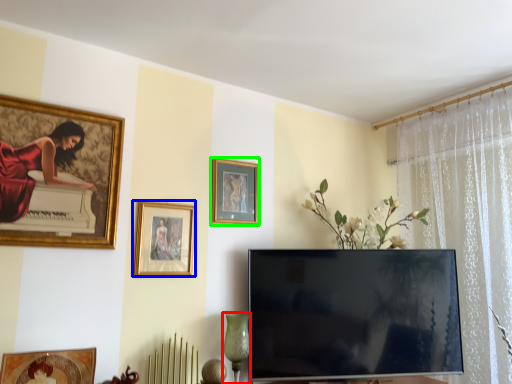
Question: Based on their relative distances, which object is nearer to glass vase (highlighted by a red box)? Choose from picture frame (highlighted by a blue box) and picture frame (highlighted by a green box).

Choices:
 (A) picture frame
 (B) picture frame

Answer: (A)